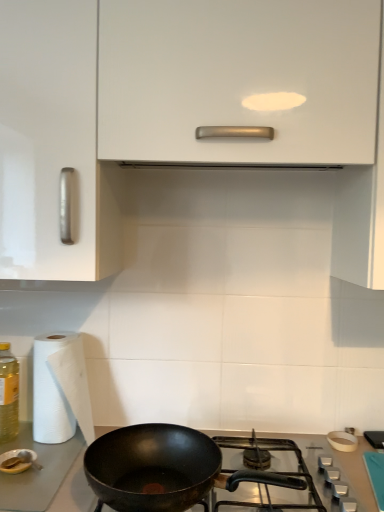
Question: Looking at the image, does white paper at left seem bigger or smaller compared to translucent yellow bottle at left?

Choices:
 (A) small
 (B) big

Answer: (B)

Question: From the image's perspective, is white paper at left positioned above or below translucent yellow bottle at left?

Choices:
 (A) above
 (B) below

Answer: (B)

Question: Which is nearer to the translucent yellow bottle at left?

Choices:
 (A) white glossy cabinet at upper center
 (B) black matte pan at lower center
 (C) white paper at left

Answer: (C)

Question: Estimate the real-world distances between objects in this image. Which object is farther from the white glossy cabinet at upper center?

Choices:
 (A) white paper at left
 (B) translucent yellow bottle at left
 (C) black matte pan at lower center

Answer: (B)